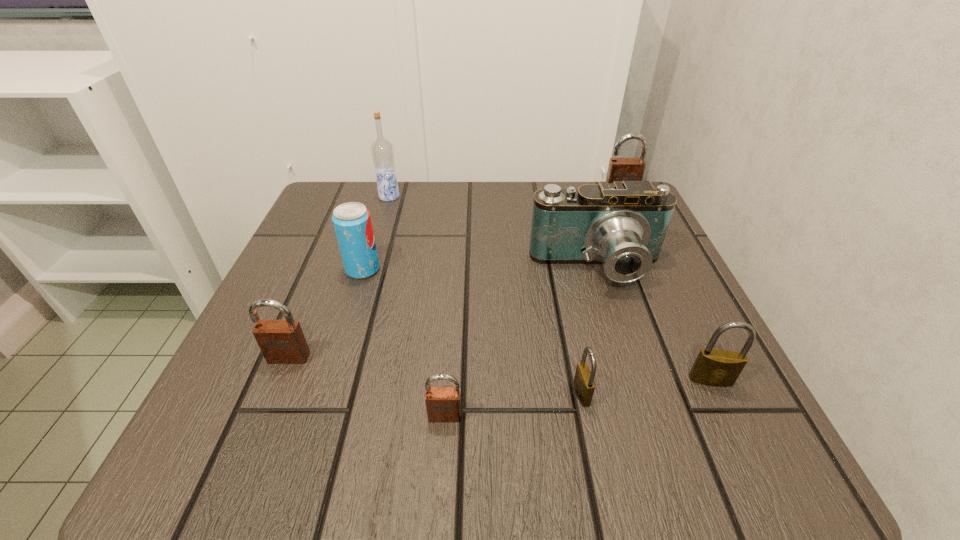
This screenshot has height=540, width=960. In order to click on vodka located at the far edge in this screenshot , I will do `click(382, 151)`.

The height and width of the screenshot is (540, 960). I want to click on padlock situated at the far edge, so click(x=620, y=169).

In order to click on object that is at the near edge in this screenshot , I will do `click(443, 404)`.

You are a GUI agent. You are given a task and a screenshot of the screen. Output one action in this format:
    pyautogui.click(x=<x>, y=<y>)
    Task: Click on the vodka present at the left edge
    This screenshot has width=960, height=540.
    Given the screenshot: What is the action you would take?
    [x=382, y=151]

Identify the location of soda can present at the left edge. (352, 222).

Where is `padlock at the left edge`? This screenshot has width=960, height=540. padlock at the left edge is located at coordinates (281, 341).

Where is `camcorder that is at the right edge`? camcorder that is at the right edge is located at coordinates click(623, 225).

Identify the location of object present at the far left corner. The image size is (960, 540). (382, 151).

This screenshot has width=960, height=540. Identify the location of object present at the far right corner. (620, 169).

I want to click on free region at the far edge of the desktop, so click(428, 207).